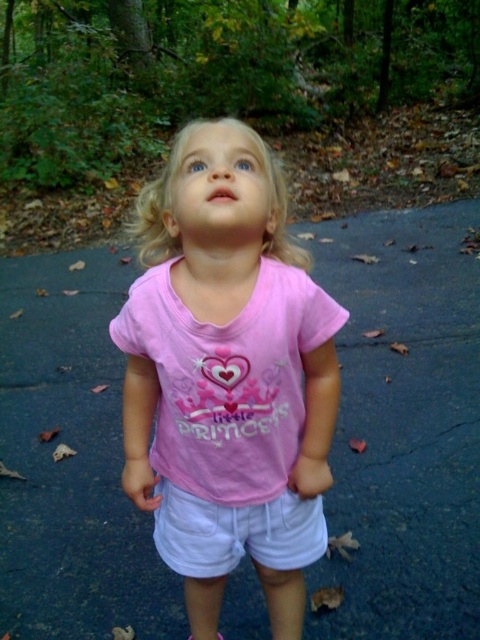
Question: Does matte asphalt pavement at center have a smaller size compared to pink fabric sandal at lower center?

Choices:
 (A) no
 (B) yes

Answer: (A)

Question: Does matte asphalt pavement at center appear on the left side of pink fabric shirt at center?

Choices:
 (A) no
 (B) yes

Answer: (A)

Question: Considering the real-world distances, which object is closest to the pink fabric shirt at center?

Choices:
 (A) white cotton shorts at center
 (B) pink fabric sandal at lower center

Answer: (A)

Question: Can you confirm if white cotton shorts at center is positioned below pink fabric sandal at lower center?

Choices:
 (A) no
 (B) yes

Answer: (A)

Question: Which object is closer to the camera taking this photo?

Choices:
 (A) matte asphalt pavement at center
 (B) white cotton shorts at center

Answer: (B)

Question: Which point is farther to the camera?

Choices:
 (A) (154, 186)
 (B) (444, 416)
 (C) (217, 637)
 (D) (296, 513)

Answer: (B)